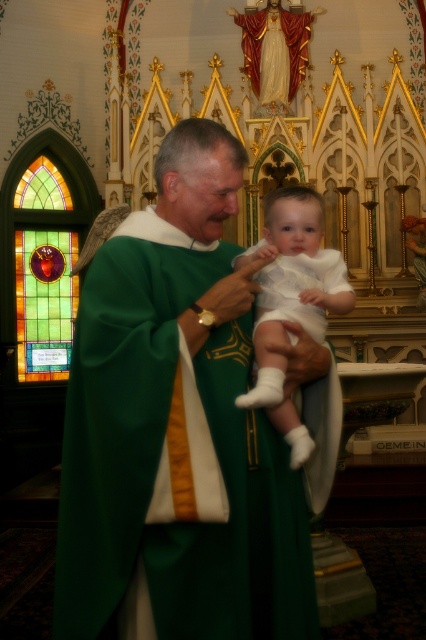
Is white smooth fabric baby at center above stained glass window at left?

Actually, white smooth fabric baby at center is below stained glass window at left.

Can you confirm if white smooth fabric baby at center is smaller than stained glass window at left?

Actually, white smooth fabric baby at center might be larger than stained glass window at left.

Which is in front, point (290, 424) or point (16, 241)?

Point (290, 424) is more forward.

Identify the location of white smooth fabric baby at center. This screenshot has height=640, width=426. (291, 300).

Which is above, green satin robe at center or stained glass window at left?

stained glass window at left is higher up.

Does green satin robe at center have a greater width compared to stained glass window at left?

Yes, green satin robe at center is wider than stained glass window at left.

Describe the element at coordinates (172, 460) in the screenshot. The width and height of the screenshot is (426, 640). I see `green satin robe at center` at that location.

Locate an element on the screen. green satin robe at center is located at coordinates (172, 460).

Who is more distant from viewer, (218,408) or (330,273)?

The point (330,273) is more distant.

Does green satin robe at center appear over white smooth fabric baby at center?

No.

Which is behind, point (221, 346) or point (267, 326)?

Positioned behind is point (267, 326).

Locate an element on the screen. This screenshot has width=426, height=640. green satin robe at center is located at coordinates (172, 460).